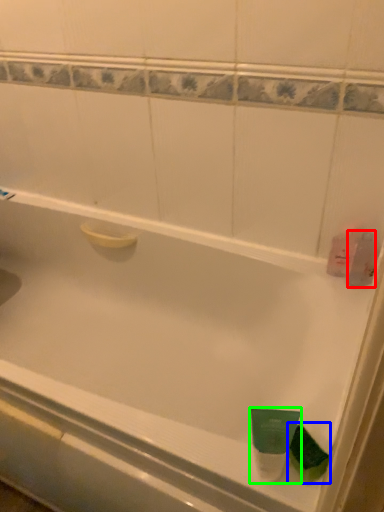
Question: Estimate the real-world distances between objects in this image. Which object is closer to mouthwash (highlighted by a red box), mouthwash (highlighted by a blue box) or mouthwash (highlighted by a green box)?

Choices:
 (A) mouthwash
 (B) mouthwash

Answer: (A)